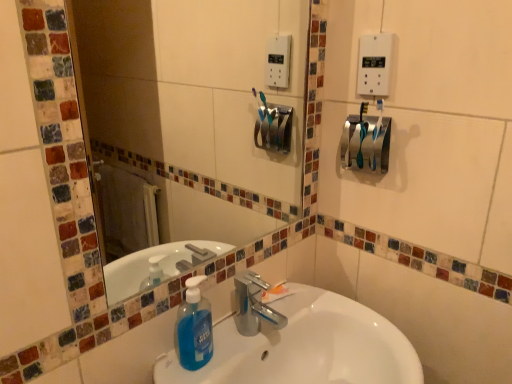
Question: From the image's perspective, does white plastic light switch at upper right appear lower than blue translucent liquid soap at center?

Choices:
 (A) yes
 (B) no

Answer: (B)

Question: From a real-world perspective, is white plastic light switch at upper right positioned under blue translucent liquid soap at center based on gravity?

Choices:
 (A) no
 (B) yes

Answer: (A)

Question: Is white plastic light switch at upper right not inside blue translucent liquid soap at center?

Choices:
 (A) no
 (B) yes

Answer: (B)

Question: Is blue translucent liquid soap at center a part of white plastic light switch at upper right?

Choices:
 (A) yes
 (B) no

Answer: (B)

Question: Is white plastic light switch at upper right at the right side of blue translucent liquid soap at center?

Choices:
 (A) yes
 (B) no

Answer: (A)

Question: Is white plastic light switch at upper right wider than blue translucent liquid soap at center?

Choices:
 (A) yes
 (B) no

Answer: (B)

Question: Is satin silver towel bar at upper right not within glass mosaic mirror at upper center?

Choices:
 (A) yes
 (B) no

Answer: (A)

Question: Is satin silver towel bar at upper right positioned behind glass mosaic mirror at upper center?

Choices:
 (A) yes
 (B) no

Answer: (A)

Question: Does satin silver towel bar at upper right have a lesser height compared to glass mosaic mirror at upper center?

Choices:
 (A) yes
 (B) no

Answer: (A)

Question: Is satin silver towel bar at upper right in front of glass mosaic mirror at upper center?

Choices:
 (A) yes
 (B) no

Answer: (B)

Question: Is satin silver towel bar at upper right directly adjacent to glass mosaic mirror at upper center?

Choices:
 (A) no
 (B) yes

Answer: (A)

Question: From the image's perspective, is satin silver towel bar at upper right under glass mosaic mirror at upper center?

Choices:
 (A) no
 (B) yes

Answer: (A)

Question: Would you say white plastic light switch at upper right contains glass mosaic mirror at upper center?

Choices:
 (A) yes
 (B) no

Answer: (B)